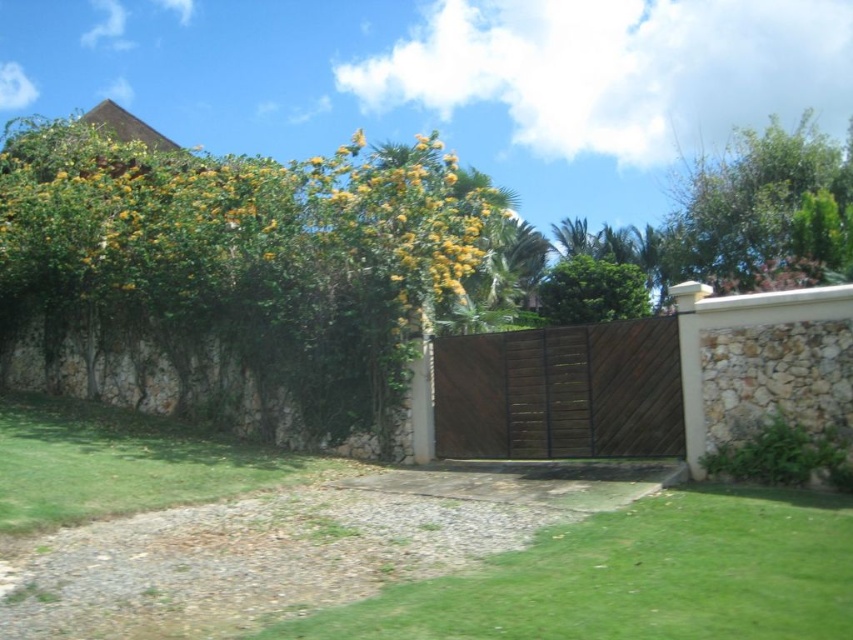
You are standing at the entrance of the property and want to locate the dark brown wood gate at center. According to the coordinates provided, where should you look relative to your position?

The dark brown wood gate at center is located at coordinates point [560,392], which means it is positioned to the right and slightly below your current viewpoint.

You are a gardener planning to trim the green leafy bush at upper left and the green leafy tree at upper right. Based on their positions relative to each other, which one should you tackle first if you want to work from the nearest to the farthest point from your current position?

You should trim the green leafy bush at upper left first because it is in front of the green leafy tree at upper right, making it closer to your current position.

You are standing at the entrance of the property and want to take a photo of the two points mentioned. Which point, point (431, 193) or point (793, 212), will appear larger in your camera view?

Point (431, 193) will appear larger in the camera view because it is closer to the camera than point (793, 212).